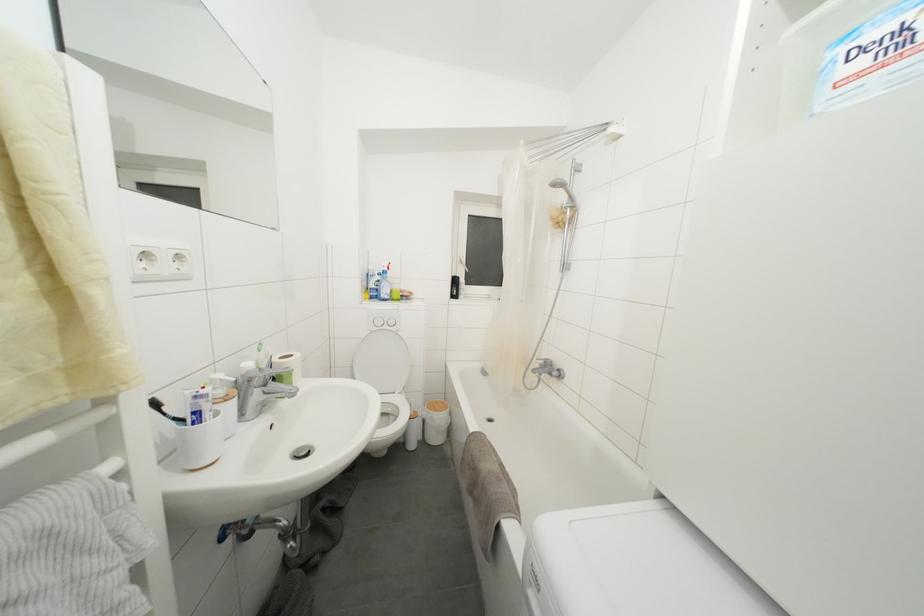
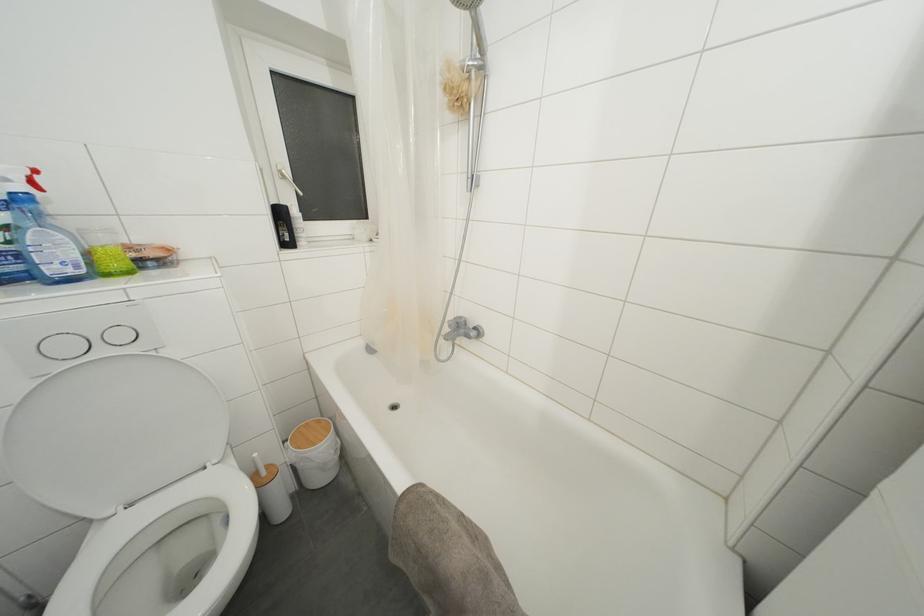
Find the pixel in the second image that matches (x=399, y=292) in the first image.

(108, 245)